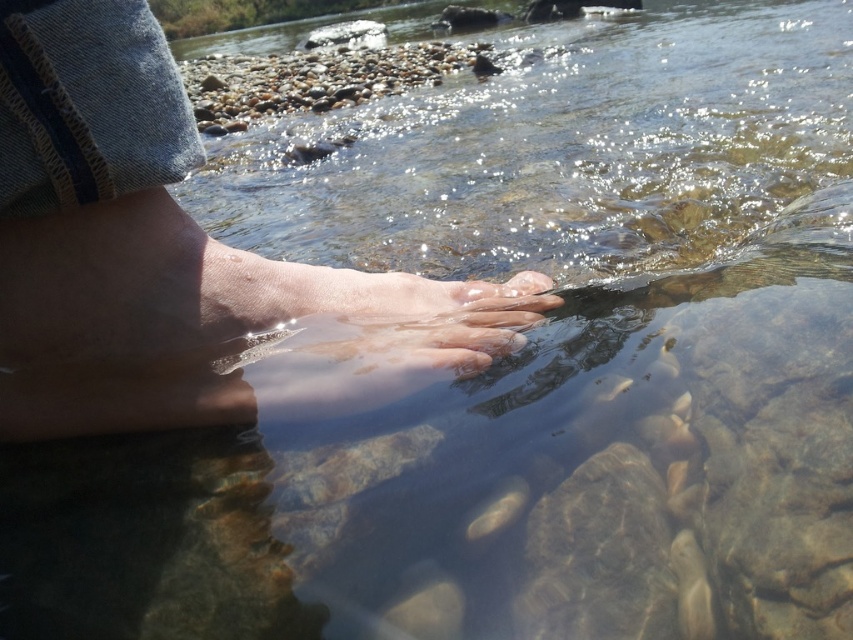
You are standing at the point marked as point (97,88) and want to take a photo of the river scene. The camera you have can capture objects up to 16 inches away. Will the camera be able to capture the entire scene clearly?

The point marked as point (97,88) and the camera are 15.96 inches apart, which is within the camera range of 16 inches. Therefore, the camera can capture the entire scene clearly.

Looking at this image, you are a photographer trying to capture the reflection of the smooth skin foot at center in the river. The camera is currently positioned 13.99 inches away from the foot. To ensure the reflection is clear, you need to adjust the distance between the camera and the foot to be exactly 14 inches. Should you move the camera closer or farther away?

The camera is currently 13.99 inches away from the smooth skin foot at center, which is just 0.01 inches less than the required 14 inches. Therefore, you should move the camera slightly farther away to achieve the exact distance of 14 inches.

You are a photographer trying to capture the reflection of the smooth skin foot at center in the river. The point at coordinates (160, 248) marks where the foot is located. To ensure the reflection is clear, you need to know if the water at that point is still or rippled. Based on the scene description, what is the condition of the water at the point corresponding to the smooth skin foot at center?

The surface of the water in the scene is described as slightly rippled, so the water at the point corresponding to the smooth skin foot at center is also slightly rippled. This may affect the clarity of the reflection.